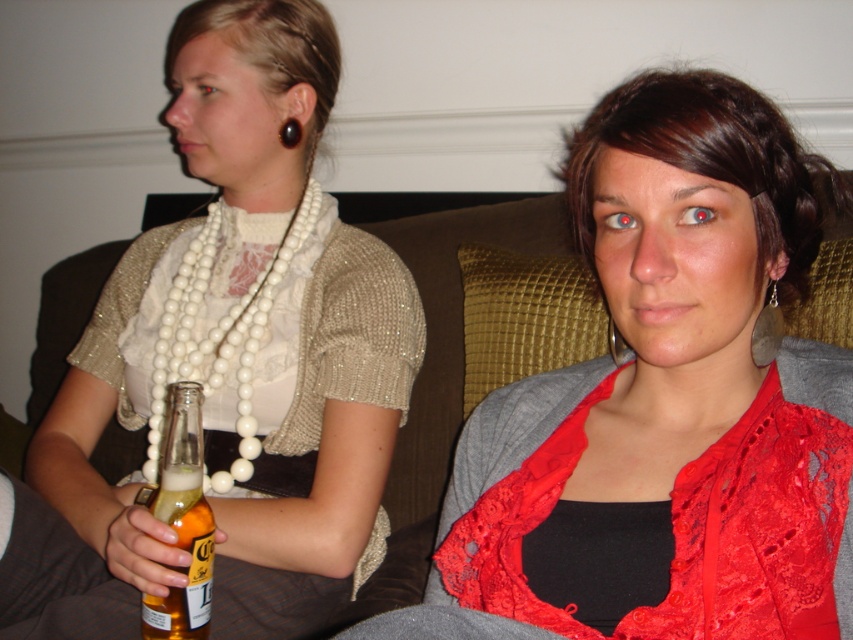
Between white pearl necklace at left and translucent glass bottle at lower left, which one appears on the left side from the viewer's perspective?

Positioned to the left is white pearl necklace at left.

Does white pearl necklace at left appear over translucent glass bottle at lower left?

Indeed, white pearl necklace at left is positioned over translucent glass bottle at lower left.

Image resolution: width=853 pixels, height=640 pixels. Describe the element at coordinates (219, 336) in the screenshot. I see `white pearl necklace at left` at that location.

The width and height of the screenshot is (853, 640). I want to click on white pearl necklace at left, so [219, 336].

Who is lower down, pearl necklace at left or white pearl necklace at left?

white pearl necklace at left is below.

Who is taller, pearl necklace at left or white pearl necklace at left?

pearl necklace at left

Who is more distant from viewer, (346,540) or (222,472)?

Positioned behind is point (222,472).

Where is `pearl necklace at left`? pearl necklace at left is located at coordinates (312, 433).

Who is more forward, (693,214) or (206,282)?

Point (693,214) is more forward.

Describe the element at coordinates (663, 404) in the screenshot. I see `lace fabric top at center` at that location.

You are a GUI agent. You are given a task and a screenshot of the screen. Output one action in this format:
    pyautogui.click(x=<x>, y=<y>)
    Task: Click on the lace fabric top at center
    This screenshot has width=853, height=640.
    Given the screenshot: What is the action you would take?
    pyautogui.click(x=663, y=404)